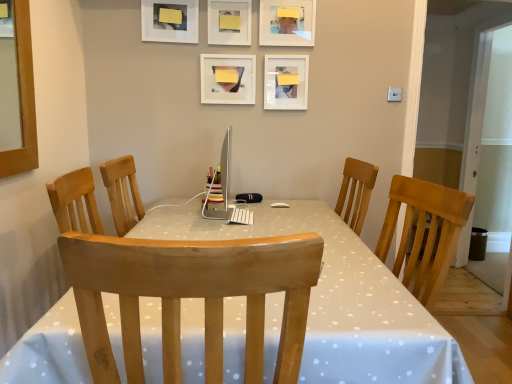
Question: Can we say white matte picture frame at upper center, acting as the fourth picture frame starting from the left, lies outside matte plastic picture frame at upper center, which is the fourth picture frame in right-to-left order?

Choices:
 (A) no
 (B) yes

Answer: (B)

Question: Does white matte picture frame at upper center, acting as the fourth picture frame starting from the left, have a greater height compared to matte plastic picture frame at upper center, positioned as the 2th picture frame in left-to-right order?

Choices:
 (A) yes
 (B) no

Answer: (A)

Question: Does white matte picture frame at upper center, acting as the fourth picture frame starting from the left, have a smaller size compared to matte plastic picture frame at upper center, which is the fourth picture frame in right-to-left order?

Choices:
 (A) no
 (B) yes

Answer: (B)

Question: From a real-world perspective, does white matte picture frame at upper center, the 2th picture frame viewed from the right, stand above matte plastic picture frame at upper center, positioned as the 2th picture frame in left-to-right order?

Choices:
 (A) yes
 (B) no

Answer: (B)

Question: Is white matte picture frame at upper center, acting as the fourth picture frame starting from the left, beside matte plastic picture frame at upper center, which is the fourth picture frame in right-to-left order?

Choices:
 (A) no
 (B) yes

Answer: (A)

Question: Considering the positions of matte white picture frame at upper center, positioned as the 1th picture frame in right-to-left order, and white matte picture frame at upper center, placed as the 3th picture frame when sorted from right to left, in the image, is matte white picture frame at upper center, positioned as the 1th picture frame in right-to-left order, bigger or smaller than white matte picture frame at upper center, placed as the 3th picture frame when sorted from right to left,?

Choices:
 (A) small
 (B) big

Answer: (B)

Question: In the image, is matte white picture frame at upper center, placed as the 5th picture frame when sorted from left to right, positioned in front of or behind white matte picture frame at upper center, the 3th picture frame from the left?

Choices:
 (A) behind
 (B) front

Answer: (B)

Question: Is matte white picture frame at upper center, positioned as the 1th picture frame in right-to-left order, inside or outside of white matte picture frame at upper center, the 3th picture frame from the left?

Choices:
 (A) outside
 (B) inside

Answer: (A)

Question: From their relative heights in the image, would you say matte white picture frame at upper center, positioned as the 1th picture frame in right-to-left order, is taller or shorter than white matte picture frame at upper center, the 3th picture frame from the left?

Choices:
 (A) tall
 (B) short

Answer: (A)

Question: In the image, is white matte picture frame at upper center, the 3th picture frame from the left, on the left side or the right side of matte plastic picture frame at upper center, which is the fourth picture frame in right-to-left order?

Choices:
 (A) right
 (B) left

Answer: (A)

Question: In terms of width, does white matte picture frame at upper center, the 3th picture frame from the left, look wider or thinner when compared to matte plastic picture frame at upper center, which is the fourth picture frame in right-to-left order?

Choices:
 (A) thin
 (B) wide

Answer: (A)

Question: From the image's perspective, is white matte picture frame at upper center, placed as the 3th picture frame when sorted from right to left, above or below matte plastic picture frame at upper center, positioned as the 2th picture frame in left-to-right order?

Choices:
 (A) below
 (B) above

Answer: (B)

Question: From a real-world perspective, relative to matte plastic picture frame at upper center, positioned as the 2th picture frame in left-to-right order, is white matte picture frame at upper center, the 3th picture frame from the left, vertically above or below?

Choices:
 (A) below
 (B) above

Answer: (B)

Question: In the image, is matte plastic picture frame at upper center, positioned as the 2th picture frame in left-to-right order, on the left side or the right side of matte white picture frame at upper center, positioned as the 1th picture frame in right-to-left order?

Choices:
 (A) right
 (B) left

Answer: (B)

Question: Based on their sizes in the image, would you say matte plastic picture frame at upper center, positioned as the 2th picture frame in left-to-right order, is bigger or smaller than matte white picture frame at upper center, placed as the 5th picture frame when sorted from left to right?

Choices:
 (A) big
 (B) small

Answer: (B)